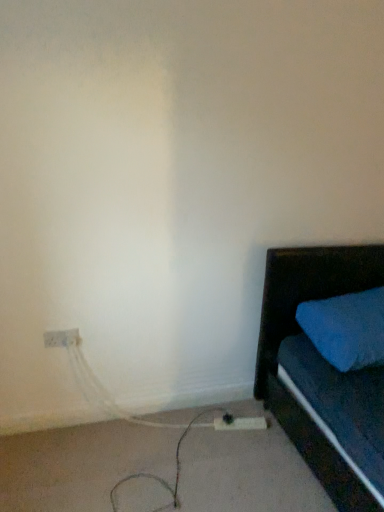
Question: Is white matte cable at lower left thinner than white plastic extension cord at lower center?

Choices:
 (A) no
 (B) yes

Answer: (A)

Question: From the image's perspective, is white matte cable at lower left above white plastic extension cord at lower center?

Choices:
 (A) no
 (B) yes

Answer: (A)

Question: Is white matte cable at lower left at the left side of white plastic extension cord at lower center?

Choices:
 (A) yes
 (B) no

Answer: (A)

Question: From a real-world perspective, does white matte cable at lower left stand above white plastic extension cord at lower center?

Choices:
 (A) yes
 (B) no

Answer: (B)

Question: Can you confirm if white matte cable at lower left is shorter than white plastic extension cord at lower center?

Choices:
 (A) yes
 (B) no

Answer: (B)

Question: From the image's perspective, is white matte cable at lower left below white plastic extension cord at lower center?

Choices:
 (A) no
 (B) yes

Answer: (B)

Question: Is white plastic electric outlet at lower left wider than white plastic extension cord at lower center?

Choices:
 (A) no
 (B) yes

Answer: (A)

Question: Can you confirm if white plastic electric outlet at lower left is smaller than white plastic extension cord at lower center?

Choices:
 (A) yes
 (B) no

Answer: (A)

Question: From the image's perspective, is white plastic electric outlet at lower left above white plastic extension cord at lower center?

Choices:
 (A) no
 (B) yes

Answer: (B)

Question: From a real-world perspective, is white plastic electric outlet at lower left located higher than white plastic extension cord at lower center?

Choices:
 (A) yes
 (B) no

Answer: (A)

Question: Is white plastic electric outlet at lower left bigger than white plastic extension cord at lower center?

Choices:
 (A) no
 (B) yes

Answer: (A)

Question: Considering the relative sizes of white plastic electric outlet at lower left and white plastic extension cord at lower center in the image provided, is white plastic electric outlet at lower left thinner than white plastic extension cord at lower center?

Choices:
 (A) no
 (B) yes

Answer: (B)

Question: Can white plastic electric outlet at lower left be found inside white matte cable at lower left?

Choices:
 (A) no
 (B) yes

Answer: (A)